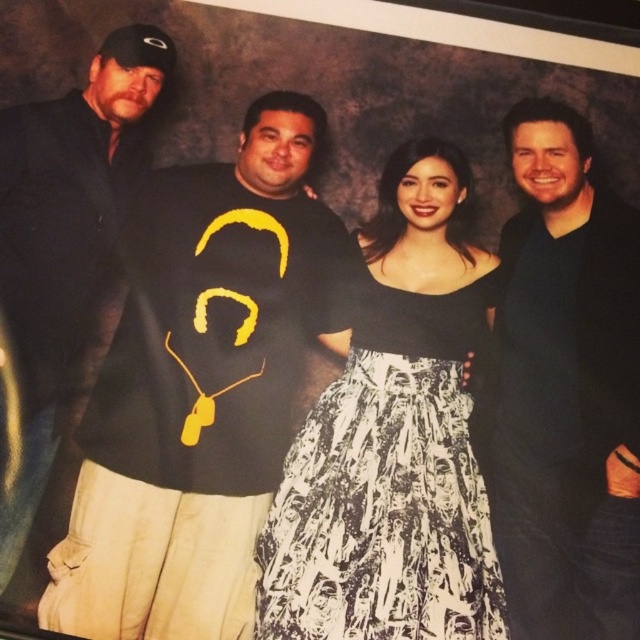
Consider the image. You are standing in front of the group photo and want to touch the black matte shirt at right and the black matte jacket at upper left. Which one can you reach first without moving your hand?

The black matte shirt at right is closer to you than the black matte jacket at upper left, so you can reach the black matte shirt at right first.

You are standing at the origin point in the image. Which of the two points, point (x=336, y=403) or point (x=29, y=198), is farther away from you?

Point (x=336, y=403) is behind point (x=29, y=198), so it is farther away from you.